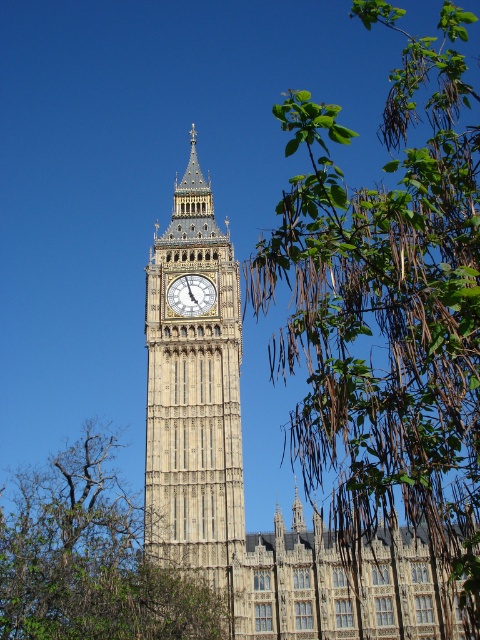
Based on the photo, you are standing at the entrance of the park and want to take a photo of the stone clock tower at center. According to the coordinates provided, where should you position yourself to capture the tower in the center of your camera frame?

The stone clock tower at center is located at coordinates point (x=194, y=401), so you should position yourself directly in front of that point to center it in your camera frame.

You are standing at the base of the Elizabeth Tower and want to take a photo of the clock face. There is a point at coordinates point (12, 582) that is 215.70 feet away from you. If your camera has a maximum focus range of 200 feet, will you be able to focus on that point?

The distance of point (12, 582) from camera is 215.70 feet, which exceeds the camera maximum focus range of 200 feet. Therefore, you cannot focus on that point.

You are standing in front of the Elizabeth Tower and notice two points marked on the tower. The first point is at coordinates point (69, 529) and the second is at point (200, 314). Which point is closer to you?

Point (69, 529) is in front of point (200, 314), so it is closer to you.